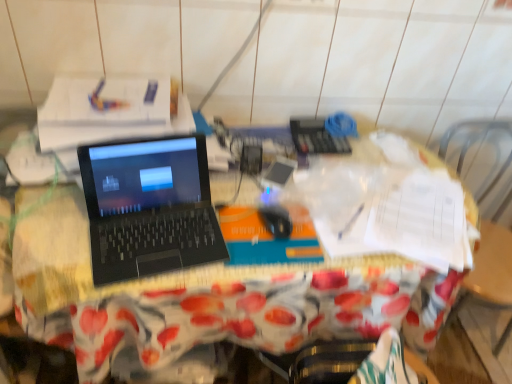
The image size is (512, 384). Find the location of `vacant location below black matte laptop at center (from a real-world perspective)`. vacant location below black matte laptop at center (from a real-world perspective) is located at coordinates (155, 240).